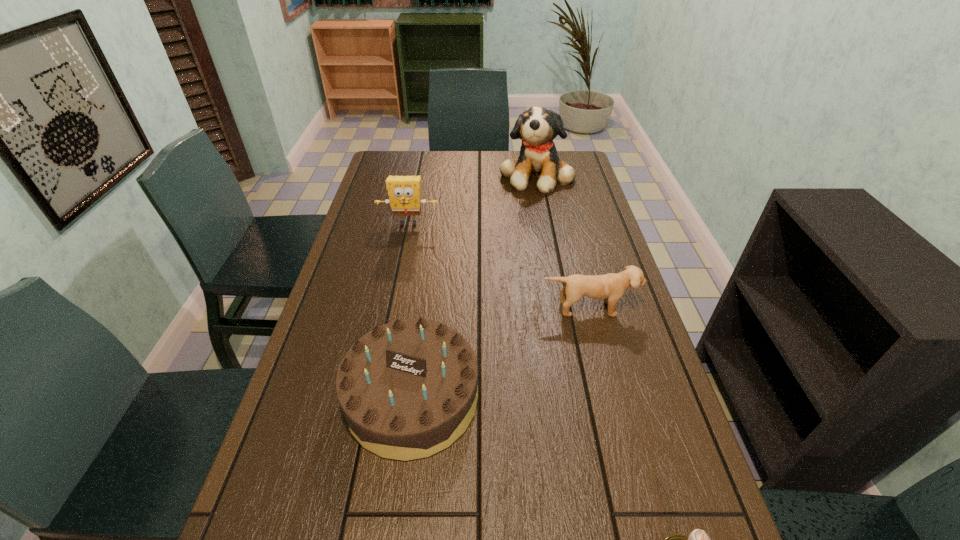
The height and width of the screenshot is (540, 960). I want to click on object that is positioned at the far edge, so click(x=537, y=127).

The height and width of the screenshot is (540, 960). What are the coordinates of `sponge at the left edge` in the screenshot? It's located at (404, 192).

This screenshot has width=960, height=540. I want to click on birthday cake that is at the left edge, so click(408, 389).

Find the location of a particular element. The image size is (960, 540). object that is at the far right corner is located at coordinates (537, 127).

Locate an element on the screen. vacant region at the left edge of the desktop is located at coordinates (369, 193).

In the image, there is a desktop. Where is `vacant space at the right edge`? The image size is (960, 540). vacant space at the right edge is located at coordinates (627, 491).

The width and height of the screenshot is (960, 540). Find the location of `vacant space at the far left corner of the desktop`. vacant space at the far left corner of the desktop is located at coordinates (410, 160).

The width and height of the screenshot is (960, 540). In order to click on vacant region at the far right corner of the desktop in this screenshot , I will do `click(576, 162)`.

You are a GUI agent. You are given a task and a screenshot of the screen. Output one action in this format:
    pyautogui.click(x=<x>, y=<y>)
    Task: Click on the empty space between the fourth nearest object and the farther puppy
    The image size is (960, 540).
    Given the screenshot: What is the action you would take?
    pyautogui.click(x=472, y=199)

The height and width of the screenshot is (540, 960). I want to click on vacant point located between the nearer puppy and the sponge, so click(499, 266).